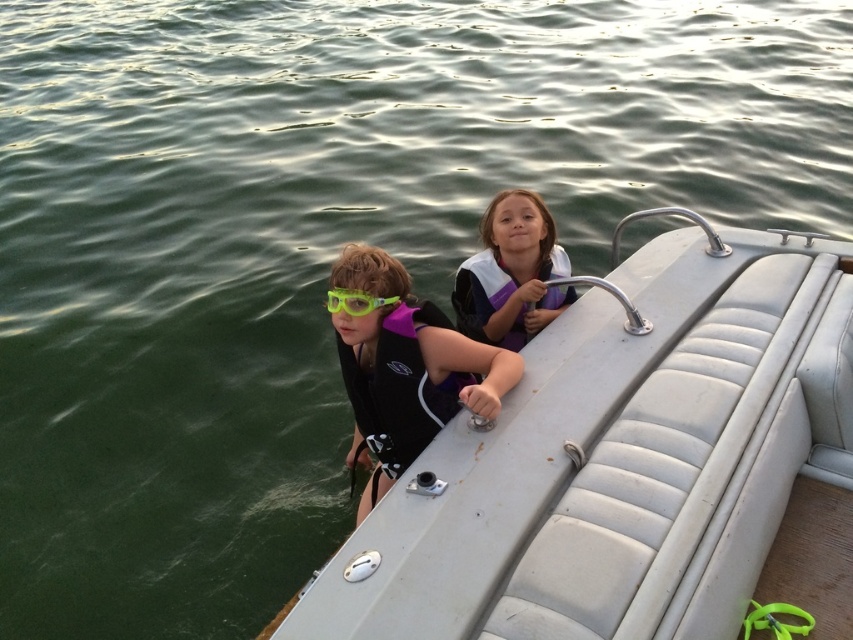
You are standing on the dock and want to board the silver leather boat at center. There is a purple neoprene life jacket at left nearby. Which item is closer to you?

The silver leather boat at center is closer to the viewer than the purple neoprene life jacket at left, so the boat is closer.

You are a lifeguard on duty and need to locate the purple neoprene life jacket at left. According to the coordinates provided, where exactly should you look on the image?

The purple neoprene life jacket at left is located at point coordinates of 0.603 on the x axis and 0.470 on the y axis.